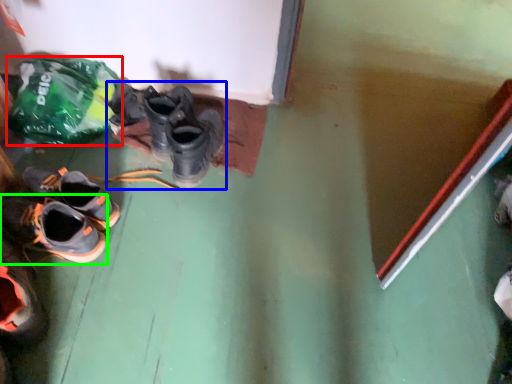
Question: Which object is positioned closest to plastic bag (highlighted by a red box)? Select from footwear (highlighted by a blue box) and shoe (highlighted by a green box).

Choices:
 (A) footwear
 (B) shoe

Answer: (A)